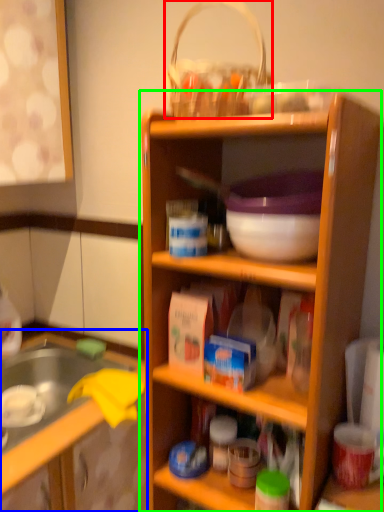
Question: Which object is positioned farthest from basket (highlighted by a red box)? Select from cabinetry (highlighted by a blue box) and shelf (highlighted by a green box).

Choices:
 (A) cabinetry
 (B) shelf

Answer: (A)